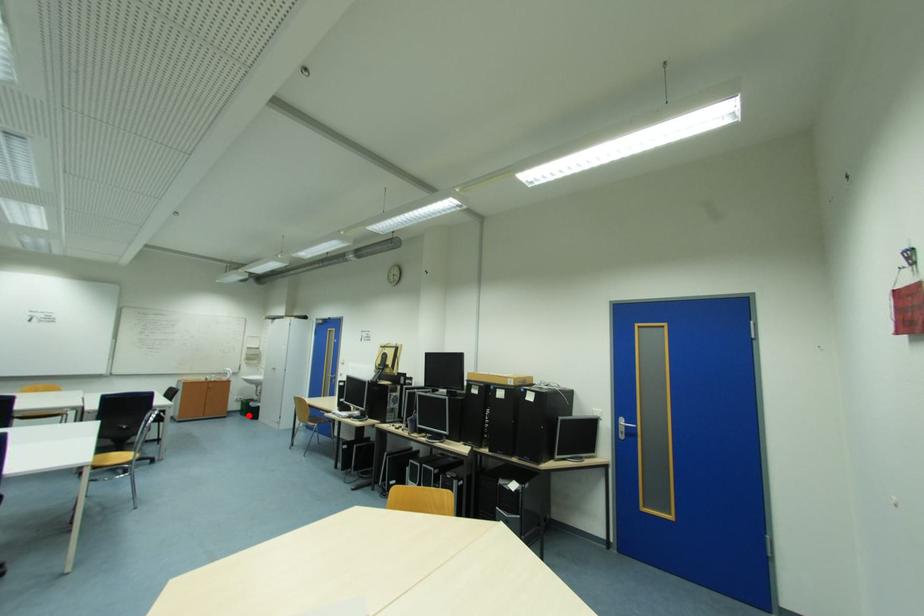
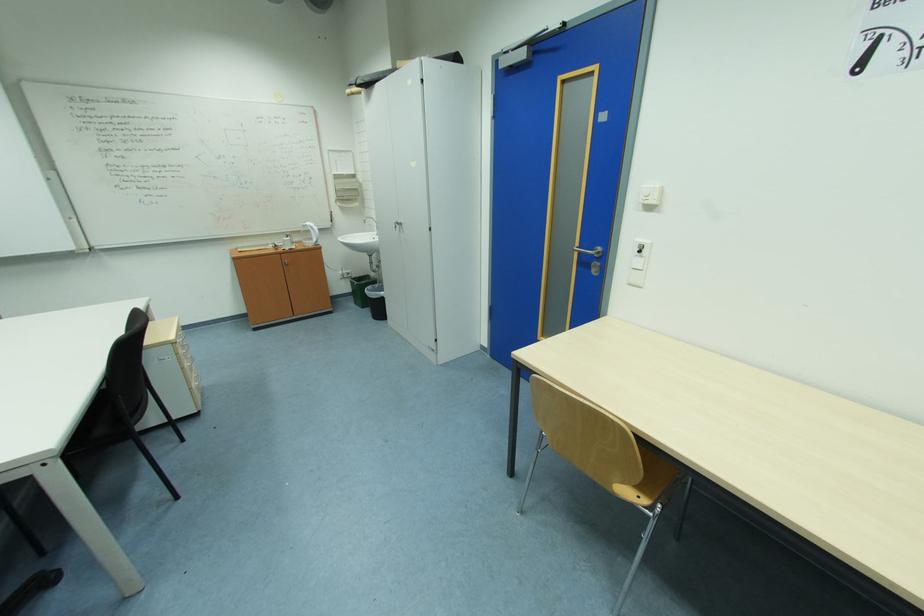
Question: I am providing you with two images of the same scene from different viewpoints. In image1, a red point is highlighted. Considering the same 3D point in image2, which of the following is correct?

Choices:
 (A) It is closer
 (B) It is farther

Answer: (A)